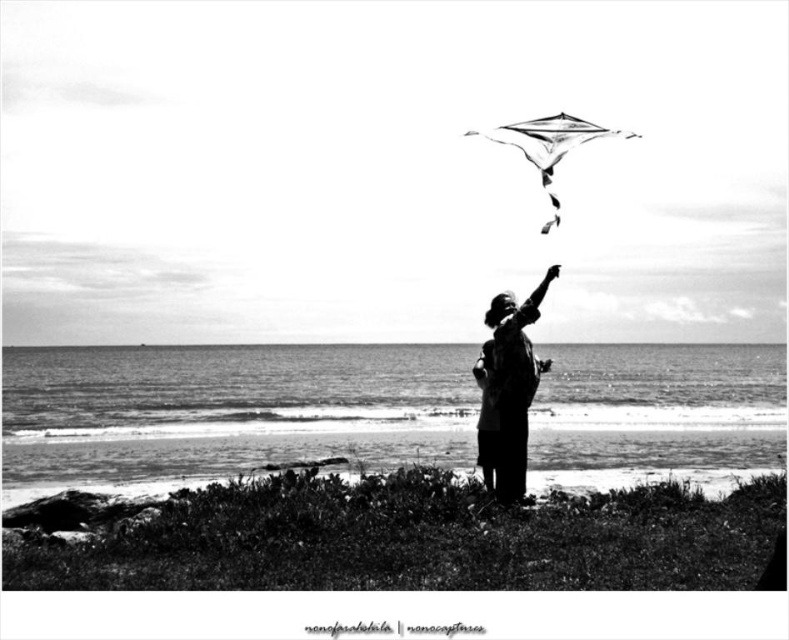
From the picture: Is the position of dark fabric shirt at center more distant than that of transparent plastic kite at upper center?

No, it is not.

Who is positioned more to the right, dark fabric shirt at center or transparent plastic kite at upper center?

transparent plastic kite at upper center

This screenshot has width=789, height=640. Find the location of `dark fabric shirt at center`. dark fabric shirt at center is located at coordinates (513, 381).